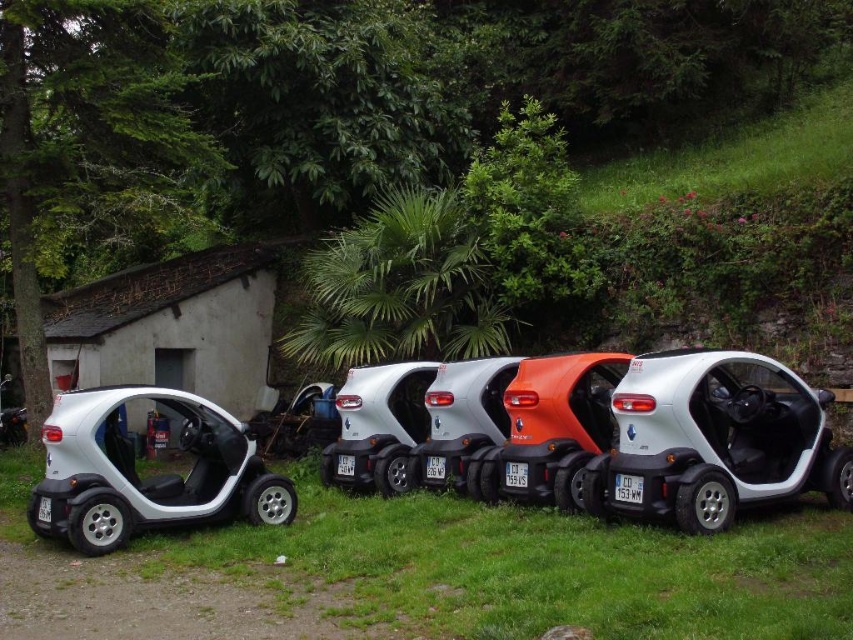
Question: Among these objects, which one is nearest to the camera?

Choices:
 (A) green grass at center
 (B) white matte car at left
 (C) satin silver car at center
 (D) white matte car at center

Answer: (A)

Question: Can you confirm if white matte car at center is wider than satin silver car at center?

Choices:
 (A) yes
 (B) no

Answer: (A)

Question: Which point appears closest to the camera in this image?

Choices:
 (A) (160, 477)
 (B) (596, 502)

Answer: (B)

Question: Does green grass at center appear over white matte car at center?

Choices:
 (A) yes
 (B) no

Answer: (B)

Question: Estimate the real-world distances between objects in this image. Which object is closer to the white matte car at center?

Choices:
 (A) green grass at center
 (B) satin silver car at center

Answer: (A)

Question: Is green grass at center closer to the viewer compared to satin silver car at center?

Choices:
 (A) no
 (B) yes

Answer: (B)